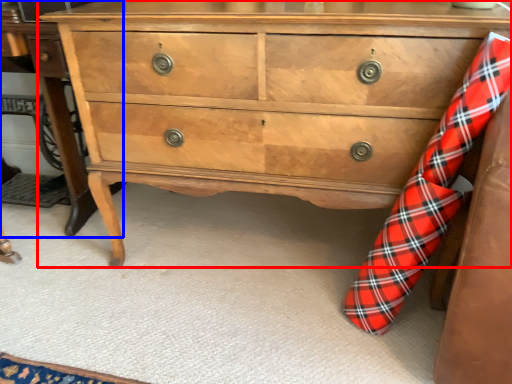
Question: Which point is further to the camera, chest of drawers (highlighted by a red box) or table (highlighted by a blue box)?

Choices:
 (A) chest of drawers
 (B) table

Answer: (B)